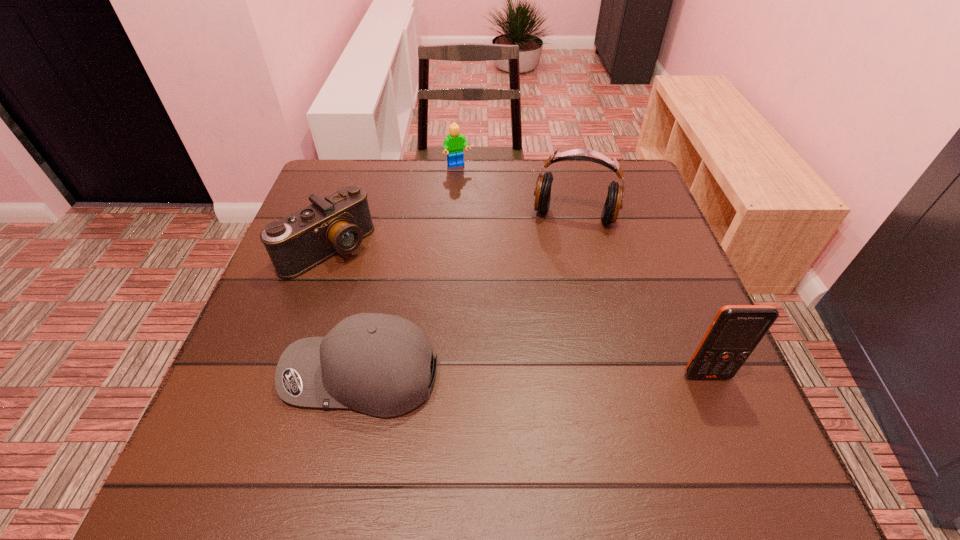
Find the location of a particular element. baseball cap is located at coordinates click(379, 364).

The image size is (960, 540). What are the coordinates of `the rightmost object` in the screenshot? It's located at (736, 330).

Find the location of a particular element. The width and height of the screenshot is (960, 540). headset is located at coordinates (542, 192).

Locate an element on the screen. This screenshot has height=540, width=960. camera is located at coordinates (338, 223).

Where is `the farthest object`? the farthest object is located at coordinates (454, 143).

Image resolution: width=960 pixels, height=540 pixels. Find the location of `free region located on the front brim of the baseball cap`. free region located on the front brim of the baseball cap is located at coordinates (233, 375).

Locate an element on the screen. The width and height of the screenshot is (960, 540). vacant space located 0.050m on the screen of the cellular telephone is located at coordinates (720, 407).

Locate an element on the screen. vacant space situated on the ear cups of the headset is located at coordinates (540, 367).

Where is `free location located on the ear cups of the headset`? The image size is (960, 540). free location located on the ear cups of the headset is located at coordinates (561, 261).

The height and width of the screenshot is (540, 960). Identify the location of vacant space located 0.380m on the ear cups of the headset. (540, 358).